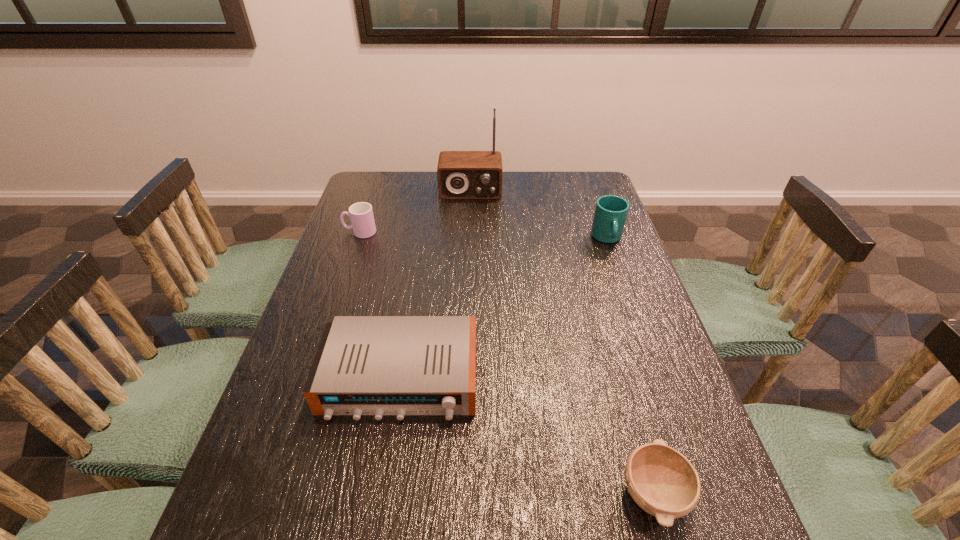
The image size is (960, 540). Find the location of `the taller radio receiver`. the taller radio receiver is located at coordinates 461,174.

Find the location of a particular element. Image resolution: width=960 pixels, height=540 pixels. the tallest object is located at coordinates (461, 174).

The width and height of the screenshot is (960, 540). What are the coordinates of `the right cup` in the screenshot? It's located at (611, 211).

Locate an element on the screen. the second tallest object is located at coordinates (611, 211).

What are the coordinates of `the left cup` in the screenshot? It's located at (361, 214).

Locate an element on the screen. Image resolution: width=960 pixels, height=540 pixels. the nearer radio receiver is located at coordinates (x=365, y=365).

Image resolution: width=960 pixels, height=540 pixels. I want to click on the fourth farthest object, so click(x=365, y=365).

What are the coordinates of `bowl` in the screenshot? It's located at (662, 481).

In order to click on vacant area situated 0.240m on the front-facing side of the tallest object in this screenshot , I will do `click(468, 244)`.

Locate an element on the screen. The height and width of the screenshot is (540, 960). vacant space located 0.380m on the handle side of the second tallest object is located at coordinates (646, 350).